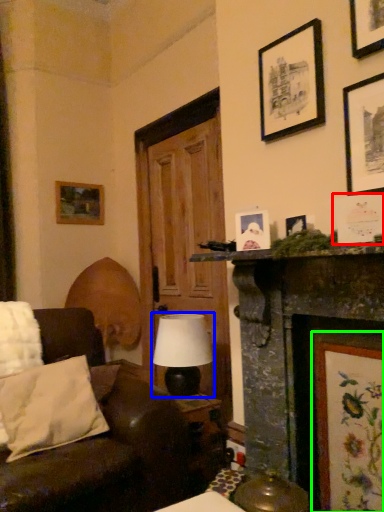
Question: Which object is positioned closest to picture frame (highlighted by a red box)? Select from table lamp (highlighted by a blue box) and picture frame (highlighted by a green box).

Choices:
 (A) table lamp
 (B) picture frame

Answer: (B)